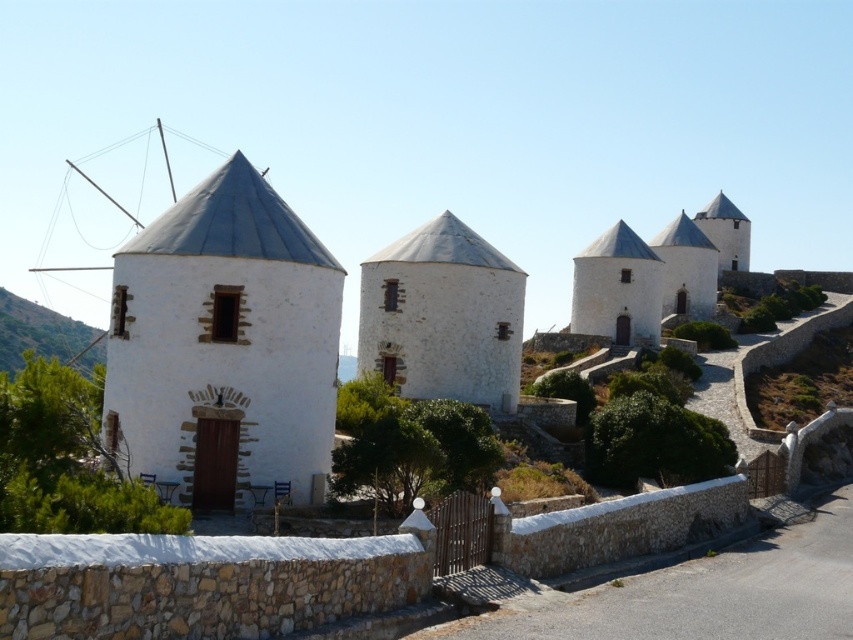
Does white stone windmill at center have a greater width compared to green grass at left?

No, white stone windmill at center is not wider than green grass at left.

What do you see at coordinates (444, 316) in the screenshot? This screenshot has width=853, height=640. I see `white stone windmill at center` at bounding box center [444, 316].

Image resolution: width=853 pixels, height=640 pixels. Describe the element at coordinates (444, 316) in the screenshot. I see `white stone windmill at center` at that location.

The image size is (853, 640). I want to click on white stone windmill at center, so click(444, 316).

From the picture: Is white stone windmill at left positioned at the back of white stone chapel at upper right?

No, it is not.

Where is `white stone windmill at left`? This screenshot has width=853, height=640. white stone windmill at left is located at coordinates (224, 346).

Is the position of green grass at left more distant than that of white stone chapel at upper right?

That is True.

Can you confirm if green grass at left is bigger than white stone chapel at upper right?

Indeed, green grass at left has a larger size compared to white stone chapel at upper right.

Find the location of a particular element. This screenshot has width=853, height=640. green grass at left is located at coordinates (38, 332).